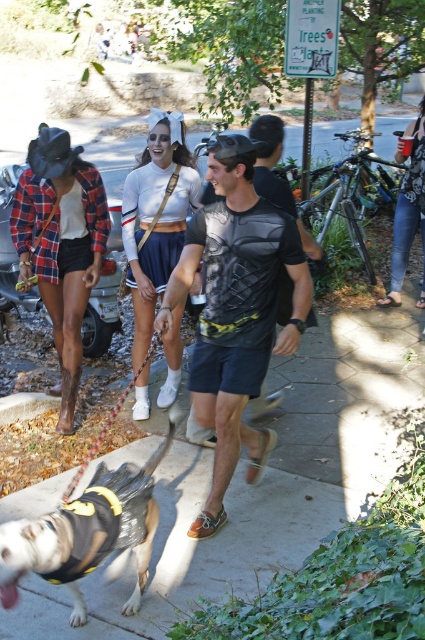
Question: Can you confirm if black mesh shirt at center is positioned above denim jeans at lower right?

Choices:
 (A) no
 (B) yes

Answer: (A)

Question: Among these objects, which one is farthest from the camera?

Choices:
 (A) black mesh shirt at center
 (B) plaid flannel shirt at left
 (C) plaid fabric leash at lower left
 (D) denim jeans at lower right

Answer: (D)

Question: Which object is positioned farthest from the plaid flannel shirt at left?

Choices:
 (A) plaid fabric leash at lower left
 (B) black mesh shirt at center

Answer: (B)

Question: Does plaid flannel shirt at left have a larger size compared to black fabric dog at center?

Choices:
 (A) no
 (B) yes

Answer: (B)

Question: Can you confirm if black mesh shirt at center is thinner than denim jeans at lower right?

Choices:
 (A) yes
 (B) no

Answer: (B)

Question: Which point is closer to the camera?

Choices:
 (A) black fabric dog at center
 (B) black mesh shirt at center
 (C) white matte jersey at center
 (D) denim jeans at lower right

Answer: (A)